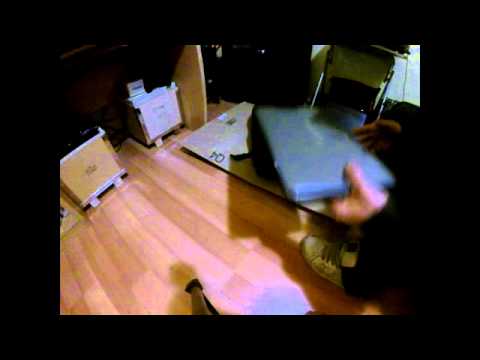
This screenshot has width=480, height=360. I want to click on wall, so click(x=90, y=82).